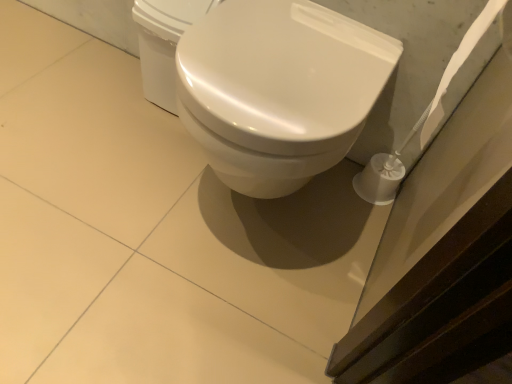
Find the location of a particular element. This screenshot has height=384, width=512. free spot in front of white glossy toilet at center is located at coordinates (180, 312).